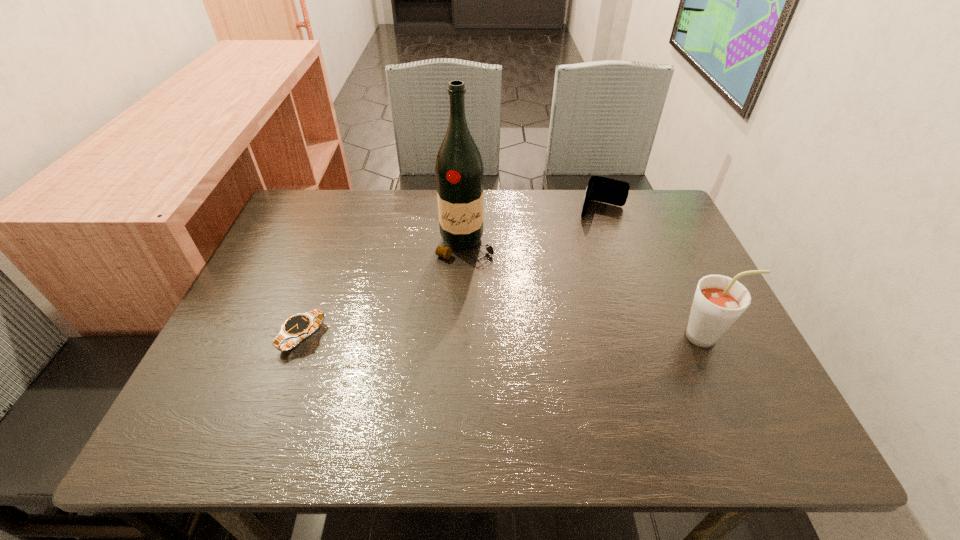
This screenshot has height=540, width=960. I want to click on vacant space that is in between the third tallest object and the watch, so click(452, 273).

Identify the location of free space between the second farthest object and the second tallest object. This screenshot has height=540, width=960. (587, 291).

Identify the location of vacant area that lies between the second object from right to left and the root beer. The image size is (960, 540). (655, 273).

I want to click on free spot between the wine bottle and the leftmost object, so click(384, 291).

You are a GUI agent. You are given a task and a screenshot of the screen. Output one action in this format:
    pyautogui.click(x=<x>, y=<y>)
    Task: Click on the vacant area that lies between the tallest object and the rightmost object
    The image size is (960, 540).
    Given the screenshot: What is the action you would take?
    pyautogui.click(x=587, y=291)

Locate an element on the screen. free space between the third nearest object and the watch is located at coordinates (384, 291).

The width and height of the screenshot is (960, 540). In order to click on free space between the watch and the third object from right to left in this screenshot , I will do `click(384, 291)`.

Locate an element on the screen. The image size is (960, 540). object that is the third nearest to the leftmost object is located at coordinates (719, 301).

Identify the location of object that is the closest to the third object from right to left. (602, 189).

The height and width of the screenshot is (540, 960). I want to click on blank area in the image that satisfies the following two spatial constraints: 1. on the back side of the leftmost object; 2. on the right side of the third object from right to left, so click(x=336, y=245).